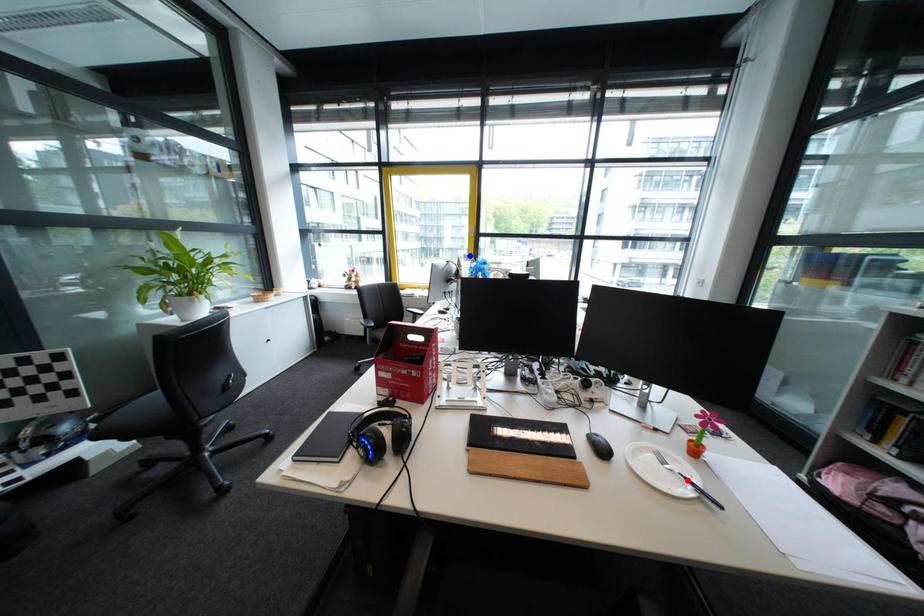
Question: Which of the two points in the image is closer to the camera?

Choices:
 (A) Blue point is closer.
 (B) Red point is closer.

Answer: (B)